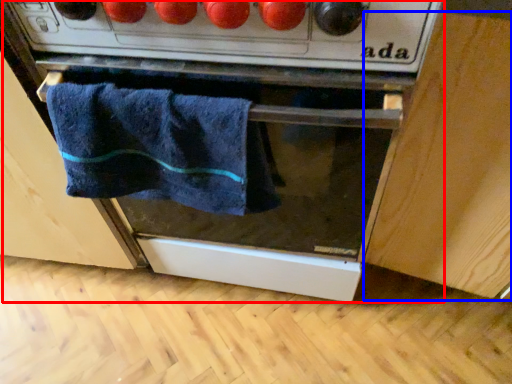
Question: Which of the following is the closest to the observer, oven (highlighted by a red box) or cabinetry (highlighted by a blue box)?

Choices:
 (A) oven
 (B) cabinetry

Answer: (B)